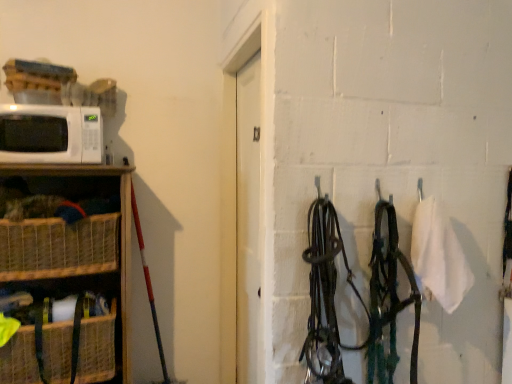
Question: Should I look upward or downward to see woven wood shelf at left?

Choices:
 (A) up
 (B) down

Answer: (B)

Question: From a real-world perspective, is woven brown basket at lower left, the 1th basket from the bottom, physically below woven brown basket at left, which appears as the first basket when viewed from the top?

Choices:
 (A) yes
 (B) no

Answer: (A)

Question: Can you confirm if woven brown basket at lower left, the 2th basket viewed from the top, is smaller than woven brown basket at left, the second basket when ordered from bottom to top?

Choices:
 (A) no
 (B) yes

Answer: (A)

Question: Does woven brown basket at lower left, the 2th basket viewed from the top, have a greater height compared to woven brown basket at left, which appears as the first basket when viewed from the top?

Choices:
 (A) no
 (B) yes

Answer: (B)

Question: Is the position of woven brown basket at lower left, the 2th basket viewed from the top, more distant than that of woven brown basket at left, the second basket when ordered from bottom to top?

Choices:
 (A) yes
 (B) no

Answer: (B)

Question: Considering the relative sizes of woven brown basket at lower left, the 1th basket from the bottom, and woven brown basket at left, which appears as the first basket when viewed from the top, in the image provided, is woven brown basket at lower left, the 1th basket from the bottom, thinner than woven brown basket at left, which appears as the first basket when viewed from the top,?

Choices:
 (A) no
 (B) yes

Answer: (A)

Question: Is woven brown basket at lower left, the 2th basket viewed from the top, shorter than woven brown basket at left, which appears as the first basket when viewed from the top?

Choices:
 (A) yes
 (B) no

Answer: (B)

Question: Is woven brown basket at lower left, the 2th basket viewed from the top, to the left of white matte microwave at left from the viewer's perspective?

Choices:
 (A) no
 (B) yes

Answer: (A)

Question: From the image's perspective, would you say woven brown basket at lower left, the 2th basket viewed from the top, is shown under white matte microwave at left?

Choices:
 (A) yes
 (B) no

Answer: (A)

Question: Can you confirm if woven brown basket at lower left, the 2th basket viewed from the top, is taller than white matte microwave at left?

Choices:
 (A) no
 (B) yes

Answer: (B)

Question: From a real-world perspective, does woven brown basket at lower left, the 1th basket from the bottom, stand above white matte microwave at left?

Choices:
 (A) no
 (B) yes

Answer: (A)

Question: Could you tell me if woven brown basket at lower left, the 1th basket from the bottom, is facing white matte microwave at left?

Choices:
 (A) no
 (B) yes

Answer: (A)

Question: Considering the relative sizes of woven brown basket at lower left, the 2th basket viewed from the top, and white matte microwave at left in the image provided, is woven brown basket at lower left, the 2th basket viewed from the top, smaller than white matte microwave at left?

Choices:
 (A) no
 (B) yes

Answer: (A)

Question: Is white matte microwave at left taller than woven brown basket at lower left, the 1th basket from the bottom?

Choices:
 (A) no
 (B) yes

Answer: (A)